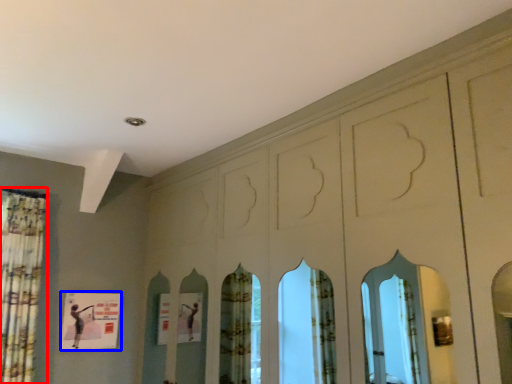
Question: Which point is closer to the camera, shower curtain (highlighted by a red box) or poster (highlighted by a blue box)?

Choices:
 (A) shower curtain
 (B) poster

Answer: (A)